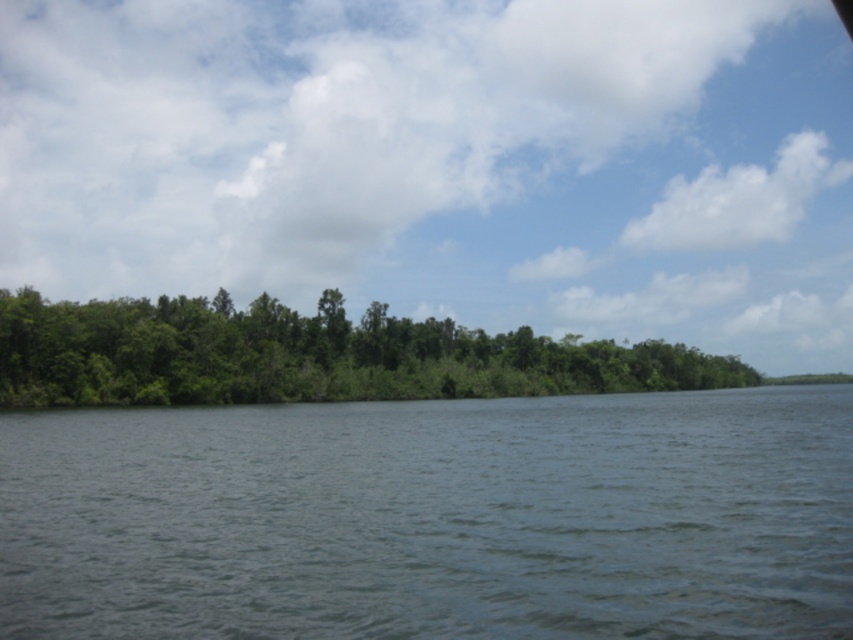
Question: Can you confirm if dark blue water at center is smaller than green leafy trees at center?

Choices:
 (A) no
 (B) yes

Answer: (B)

Question: Which point is farther to the camera?

Choices:
 (A) dark blue water at center
 (B) green leafy trees at center

Answer: (B)

Question: Can you confirm if dark blue water at center is positioned above green leafy trees at center?

Choices:
 (A) no
 (B) yes

Answer: (A)

Question: Which point is closer to the camera taking this photo?

Choices:
 (A) (689, 481)
 (B) (637, 371)

Answer: (A)

Question: Can you confirm if dark blue water at center is smaller than green leafy trees at center?

Choices:
 (A) yes
 (B) no

Answer: (A)